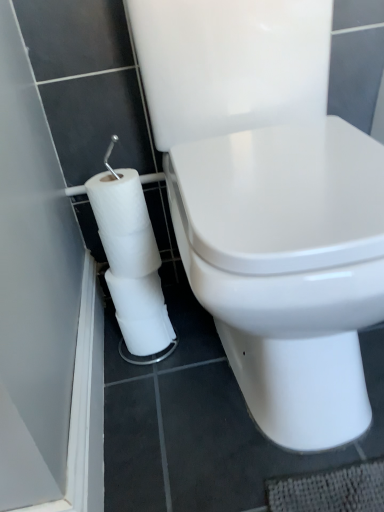
Question: Is white glossy toilet at center wider than white matte toilet paper at lower left?

Choices:
 (A) no
 (B) yes

Answer: (B)

Question: Does white glossy toilet at center have a smaller size compared to white matte toilet paper at lower left?

Choices:
 (A) no
 (B) yes

Answer: (A)

Question: Would you say white matte toilet paper at lower left is part of white glossy toilet at center's contents?

Choices:
 (A) no
 (B) yes

Answer: (A)

Question: Does white glossy toilet at center appear on the right side of white matte toilet paper at lower left?

Choices:
 (A) yes
 (B) no

Answer: (A)

Question: Is the depth of white glossy toilet at center less than that of white matte toilet paper at lower left?

Choices:
 (A) no
 (B) yes

Answer: (B)

Question: Does white glossy toilet at center have a greater height compared to white matte toilet paper at lower left?

Choices:
 (A) no
 (B) yes

Answer: (B)

Question: From the image's perspective, is white matte toilet paper at lower left below white glossy toilet at center?

Choices:
 (A) no
 (B) yes

Answer: (B)

Question: Is white matte toilet paper at lower left at the left side of white glossy toilet at center?

Choices:
 (A) yes
 (B) no

Answer: (A)

Question: From a real-world perspective, is white matte toilet paper at lower left located higher than white glossy toilet at center?

Choices:
 (A) yes
 (B) no

Answer: (B)

Question: Is white matte toilet paper at lower left next to white glossy toilet at center and touching it?

Choices:
 (A) yes
 (B) no

Answer: (B)

Question: Is white matte toilet paper at lower left positioned with its back to white glossy toilet at center?

Choices:
 (A) yes
 (B) no

Answer: (B)

Question: Is white matte toilet paper at lower left shorter than white glossy toilet at center?

Choices:
 (A) no
 (B) yes

Answer: (B)

Question: Based on their sizes in the image, would you say white glossy toilet at center is bigger or smaller than white matte toilet paper at lower left?

Choices:
 (A) small
 (B) big

Answer: (B)